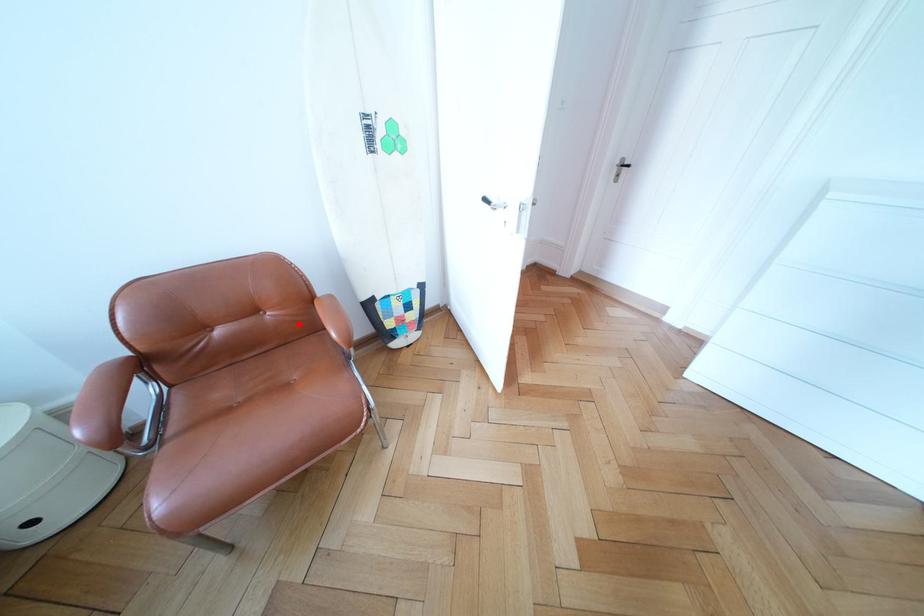
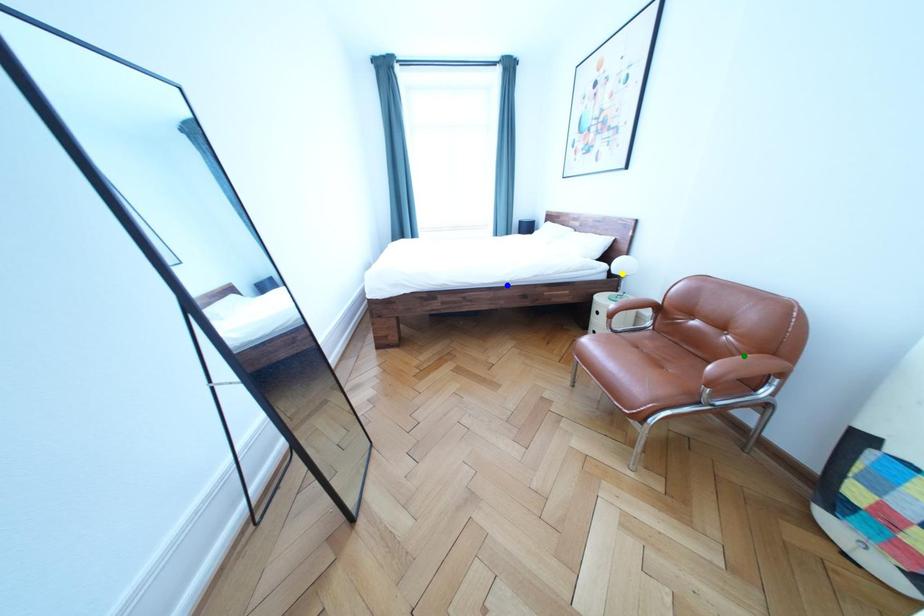
Question: I am providing you with two images of the same scene from different viewpoints. A red point is marked on the first image. You are given multiple points on the second image. Which point in image 2 represents the same 3d spot as the red point in image 1?

Choices:
 (A) blue point
 (B) yellow point
 (C) green point

Answer: (C)